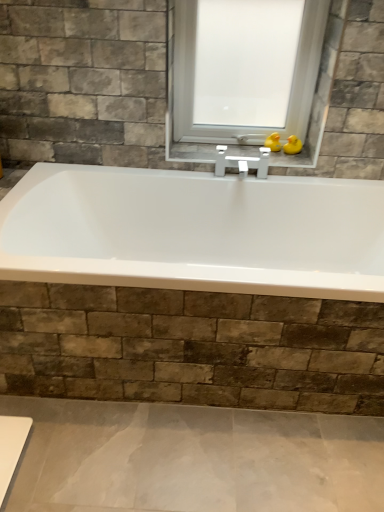
Question: Would you say transparent glass window at center is inside or outside yellow rubber duck at upper right, the 2th duck in the left-to-right sequence?

Choices:
 (A) outside
 (B) inside

Answer: (A)

Question: In terms of width, does transparent glass window at center look wider or thinner when compared to yellow rubber duck at upper right, the 2th duck in the left-to-right sequence?

Choices:
 (A) wide
 (B) thin

Answer: (A)

Question: Based on their relative distances, which object is farther from the transparent glass window at center?

Choices:
 (A) yellow rubber duck at upper right, the 1th duck when ordered from right to left
 (B) yellow rubber duck at upper center, marked as the 2th duck in a right-to-left arrangement

Answer: (A)

Question: Which of these objects is positioned closest to the yellow rubber duck at upper right, the 1th duck when ordered from right to left?

Choices:
 (A) yellow rubber duck at upper center, marked as the 2th duck in a right-to-left arrangement
 (B) transparent glass window at center

Answer: (A)